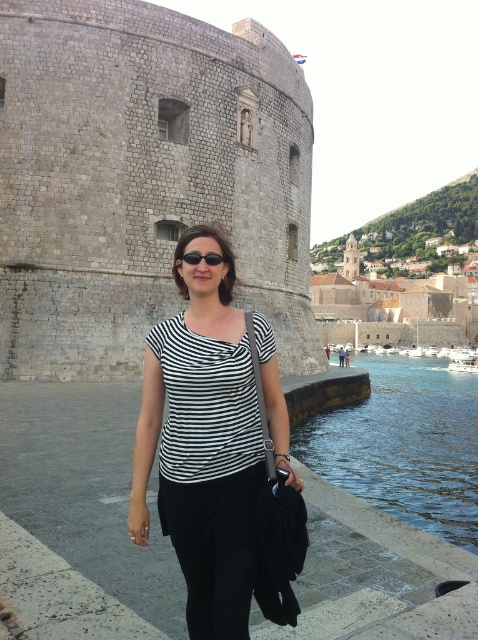
Can you confirm if clear blue water at lower right is smaller than black plastic sunglasses at center?

No, clear blue water at lower right is not smaller than black plastic sunglasses at center.

What are the coordinates of `clear blue water at lower right` in the screenshot? It's located at (403, 444).

Image resolution: width=478 pixels, height=640 pixels. Describe the element at coordinates (403, 444) in the screenshot. I see `clear blue water at lower right` at that location.

The width and height of the screenshot is (478, 640). I want to click on clear blue water at lower right, so click(x=403, y=444).

Is gray stone castle at center to the right of black striped shirt at center from the viewer's perspective?

Incorrect, gray stone castle at center is not on the right side of black striped shirt at center.

Is gray stone castle at center thinner than black striped shirt at center?

No, gray stone castle at center is not thinner than black striped shirt at center.

Which is behind, point (65, 3) or point (221, 289)?

Point (65, 3)

Where is `gray stone castle at center`? Image resolution: width=478 pixels, height=640 pixels. gray stone castle at center is located at coordinates (142, 179).

Is point (236, 456) positioned in front of point (444, 524)?

Yes, point (236, 456) is in front of point (444, 524).

Between black striped shirt at center and clear blue water at lower right, which one is positioned lower?

clear blue water at lower right is below.

Find the location of `black striped shirt at center`. black striped shirt at center is located at coordinates (203, 442).